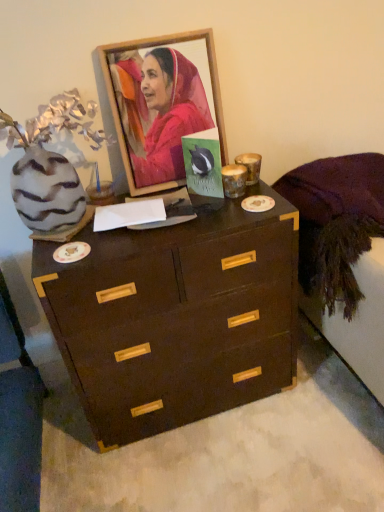
Question: Would you say purple fabric at right contains wooden picture frame at upper center?

Choices:
 (A) yes
 (B) no

Answer: (B)

Question: From a real-world perspective, is purple fabric at right beneath wooden picture frame at upper center?

Choices:
 (A) no
 (B) yes

Answer: (B)

Question: Is purple fabric at right next to wooden picture frame at upper center?

Choices:
 (A) yes
 (B) no

Answer: (B)

Question: Can you confirm if purple fabric at right is bigger than wooden picture frame at upper center?

Choices:
 (A) yes
 (B) no

Answer: (A)

Question: From the image's perspective, is purple fabric at right on wooden picture frame at upper center?

Choices:
 (A) yes
 (B) no

Answer: (B)

Question: In the image, is purple fabric at right positioned in front of or behind green matte postcard at center?

Choices:
 (A) front
 (B) behind

Answer: (A)

Question: In terms of width, does purple fabric at right look wider or thinner when compared to green matte postcard at center?

Choices:
 (A) thin
 (B) wide

Answer: (B)

Question: Looking at the image, does purple fabric at right seem bigger or smaller compared to green matte postcard at center?

Choices:
 (A) small
 (B) big

Answer: (B)

Question: In the image, is purple fabric at right on the left side or the right side of green matte postcard at center?

Choices:
 (A) right
 (B) left

Answer: (A)

Question: From a real-world perspective, is wooden picture frame at upper center physically located above or below green matte postcard at center?

Choices:
 (A) below
 (B) above

Answer: (B)

Question: Considering the positions of wooden picture frame at upper center and green matte postcard at center in the image, is wooden picture frame at upper center wider or thinner than green matte postcard at center?

Choices:
 (A) wide
 (B) thin

Answer: (B)

Question: Relative to green matte postcard at center, is wooden picture frame at upper center in front or behind?

Choices:
 (A) front
 (B) behind

Answer: (A)

Question: Is wooden picture frame at upper center taller or shorter than green matte postcard at center?

Choices:
 (A) short
 (B) tall

Answer: (B)

Question: Considering their positions, is green matte postcard at center located in front of or behind purple fabric at right?

Choices:
 (A) behind
 (B) front

Answer: (A)

Question: From the image's perspective, is green matte postcard at center above or below purple fabric at right?

Choices:
 (A) above
 (B) below

Answer: (A)